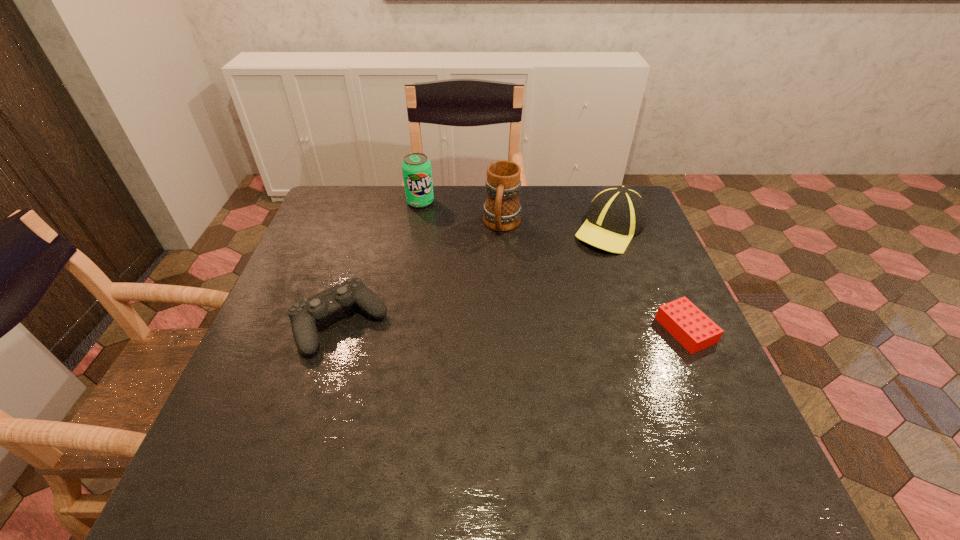
This screenshot has width=960, height=540. I want to click on free space that satisfies the following two spatial constraints: 1. on the front side of the second tallest object; 2. on the right side of the baseball cap, so click(416, 228).

The width and height of the screenshot is (960, 540). Find the location of `vacant space that satisfies the following two spatial constraints: 1. on the front side of the second shortest object; 2. on the left side of the Lego`. vacant space that satisfies the following two spatial constraints: 1. on the front side of the second shortest object; 2. on the left side of the Lego is located at coordinates point(338,330).